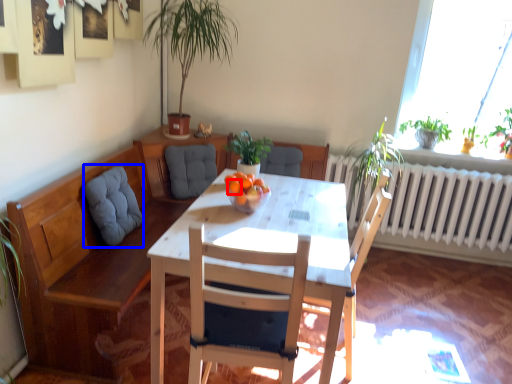
Question: Which object appears closest to the camera in this image, orange (highlighted by a red box) or swivel chair (highlighted by a blue box)?

Choices:
 (A) orange
 (B) swivel chair

Answer: (A)